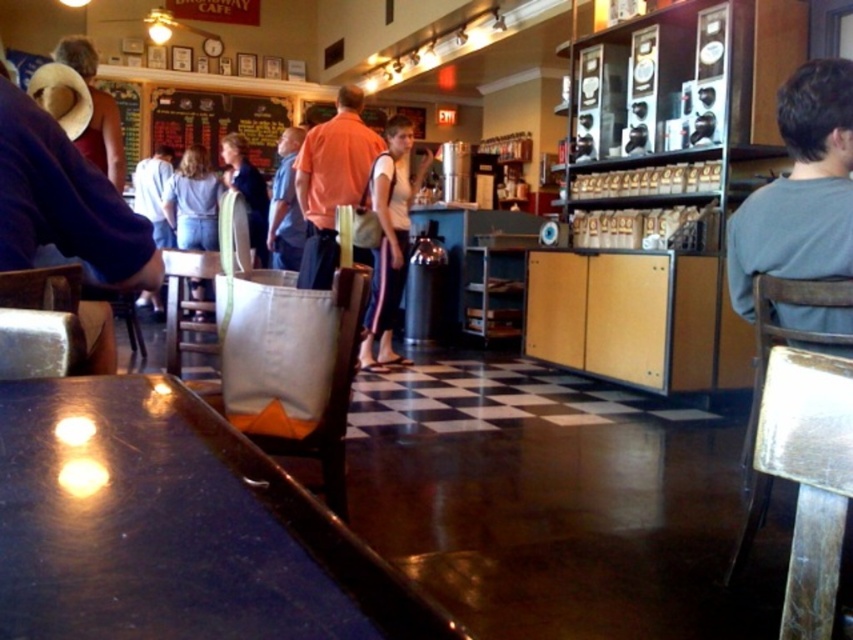
You are standing at the camera position in the diner and want to move to the point marked as point (372, 180). If your walking speed is 3 feet per second, how many seconds will it take you to reach there?

The distance between you and point (372, 180) is 14.30 feet. At a speed of 3 feet per second, dividing the distance by speed gives 14.30 divided by 3 equals approximately 4.77 seconds. So it will take about 4.77 seconds to reach the point.

You are sitting at the metallic silver table at lower right and want to reach the matte brown hat at upper left. Which direction should you move to get closer to the hat?

You should move to the left to get closer to the matte brown hat at upper left since the metallic silver table at lower right is to the right of the hat.

You are a customer in the diner and want to place your order. You see the metallic silver table at lower right and the matte brown hat at upper left. Which object is closer to you?

The metallic silver table at lower right is closer to you because it is smaller in size compared to the matte brown hat at upper left, indicating it is nearer.